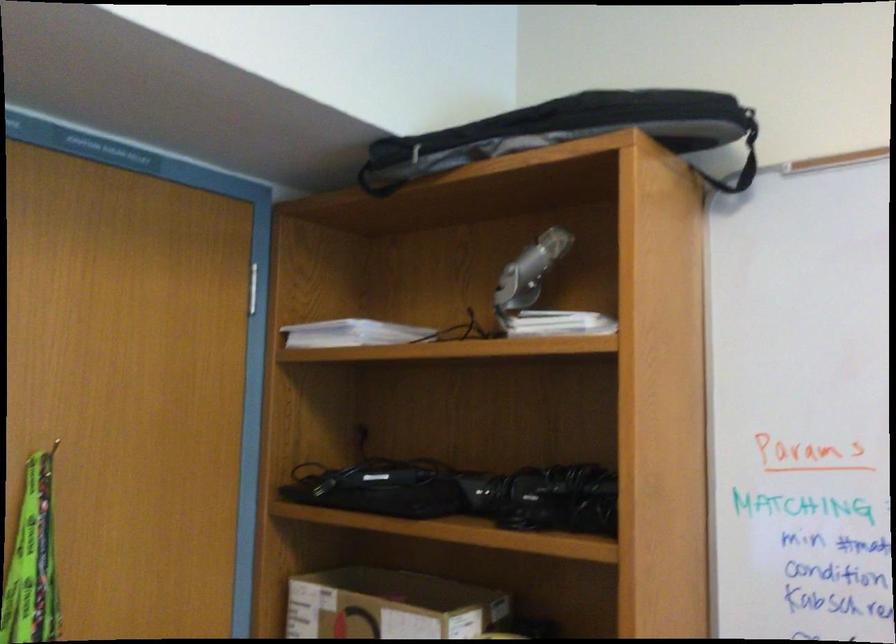
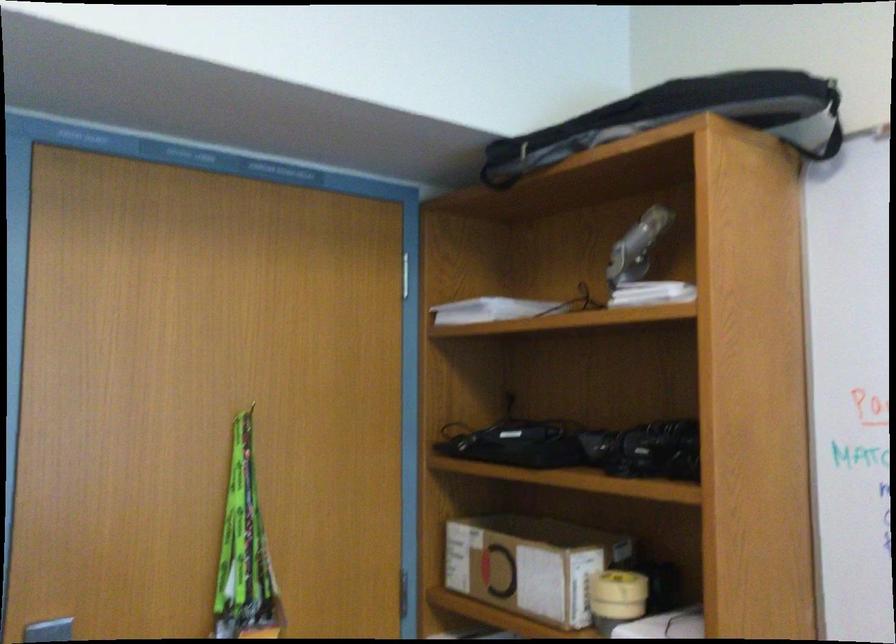
Question: The images are taken continuously from a first-person perspective. In which direction is your viewpoint rotating?

Choices:
 (A) Left
 (B) Right
 (C) Up
 (D) Down

Answer: (A)